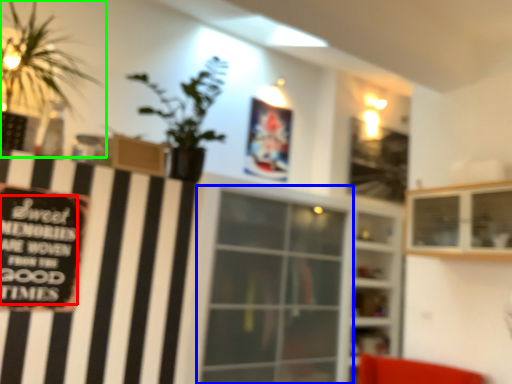
Question: Which object is the farthest from writing (highlighted by a red box)? Choose among these: window (highlighted by a blue box) or houseplant (highlighted by a green box).

Choices:
 (A) window
 (B) houseplant

Answer: (A)